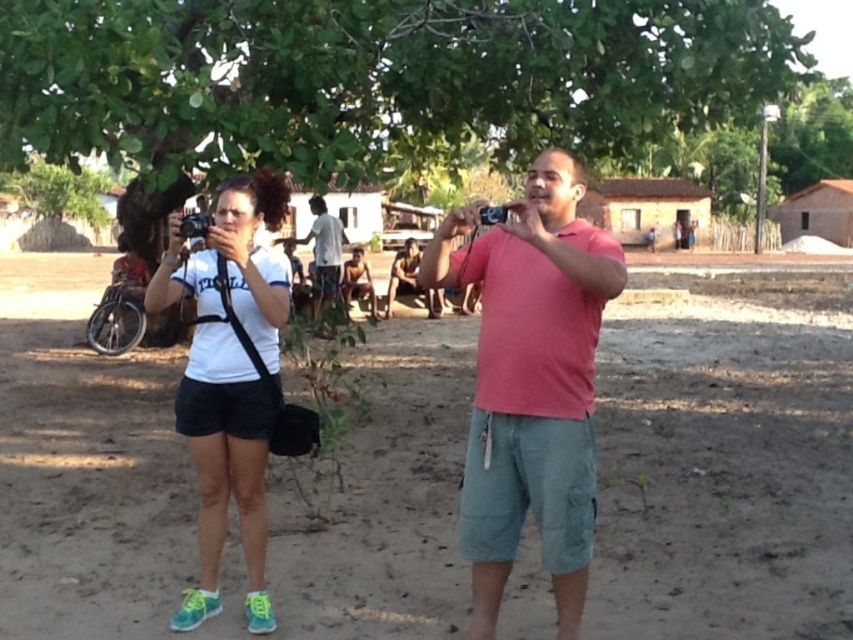
Question: Is white fabric shirt at center above white matte shirt at center?

Choices:
 (A) yes
 (B) no

Answer: (B)

Question: Which object is the farthest from the dirt field at center?

Choices:
 (A) pink cotton shirt at center
 (B) green leafy tree at center
 (C) light brown wooden stick at center
 (D) white fabric shirt at center

Answer: (B)

Question: Which of the following is the closest to the observer?

Choices:
 (A) white fabric shirt at center
 (B) white matte shirt at center
 (C) dirt field at center
 (D) light brown wooden stick at center

Answer: (A)

Question: Which is farther from the white fabric shirt at center?

Choices:
 (A) white matte shirt at center
 (B) pink cotton shirt at center
 (C) green leafy tree at center
 (D) dirt field at center

Answer: (D)

Question: Does pink cotton shirt at center have a larger size compared to light brown wooden stick at center?

Choices:
 (A) no
 (B) yes

Answer: (A)

Question: Can you confirm if green leafy tree at center is positioned to the left of white fabric shirt at center?

Choices:
 (A) yes
 (B) no

Answer: (A)